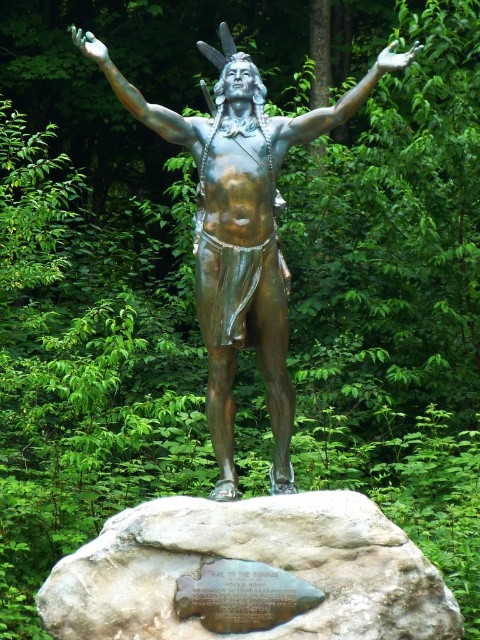
Where is the bronze statue at center located in the image?

The bronze statue at center is located at point (x=240, y=228).

You are an art student observing the bronze statue at center and the gray stone plaque at center in the image. Your professor asks which object is larger. How do you respond?

The bronze statue at center is bigger than the gray stone plaque at center, so the bronze statue at center is larger.